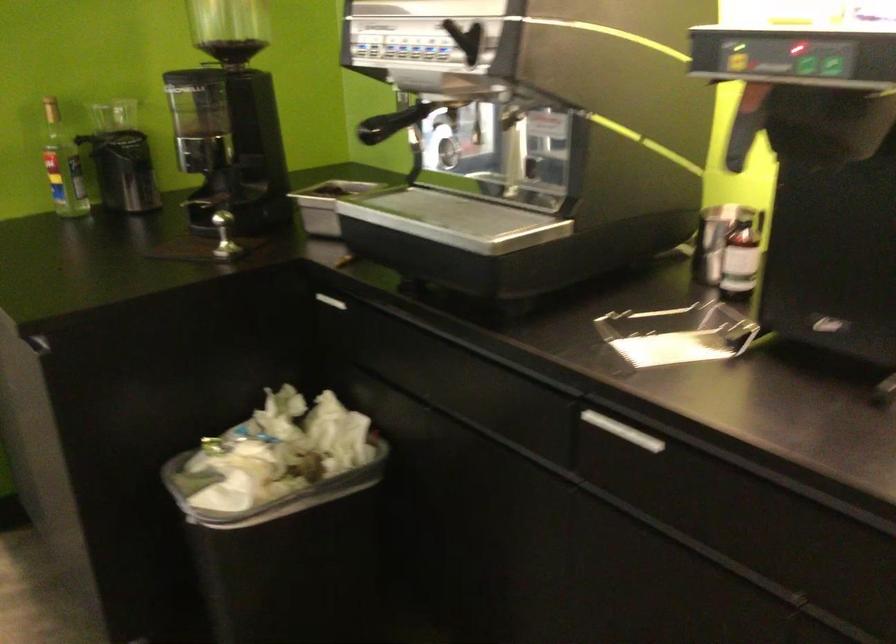
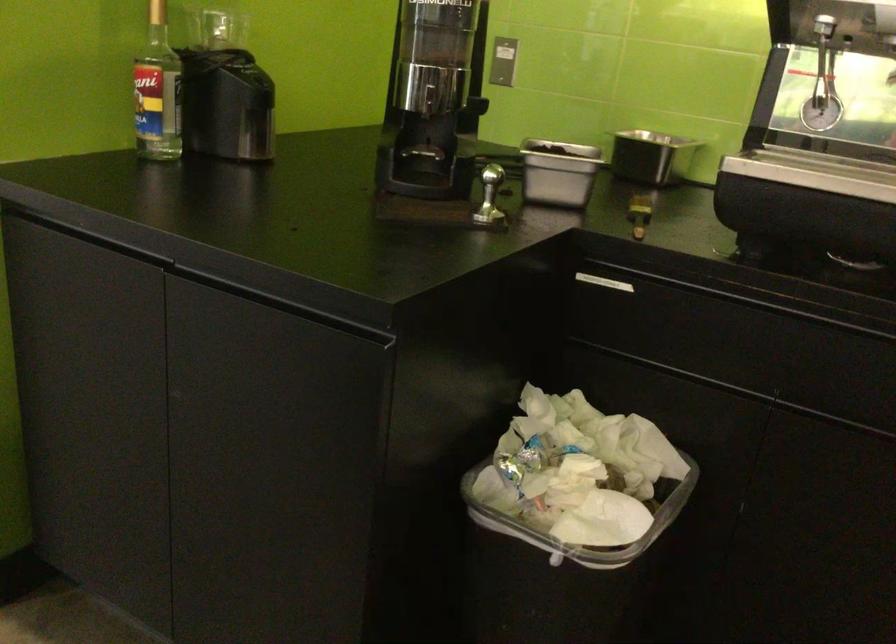
Locate, in the second image, the point that corresponds to point 128,109 in the first image.

(216, 29)